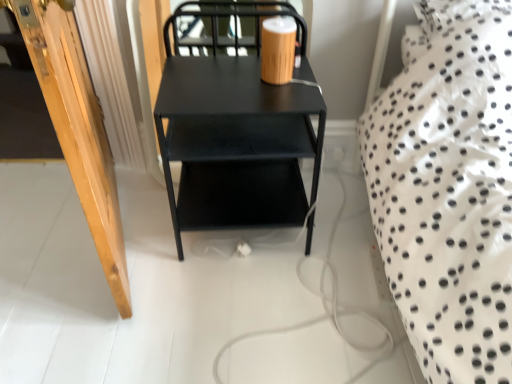
Identify the location of vacant space underneath wooden door at left (from a real-world perspective). This screenshot has width=512, height=384. (130, 228).